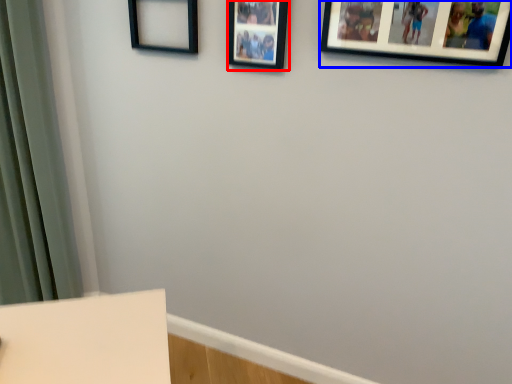
Question: Among these objects, which one is farthest to the camera, picture frame (highlighted by a red box) or picture frame (highlighted by a blue box)?

Choices:
 (A) picture frame
 (B) picture frame

Answer: (A)